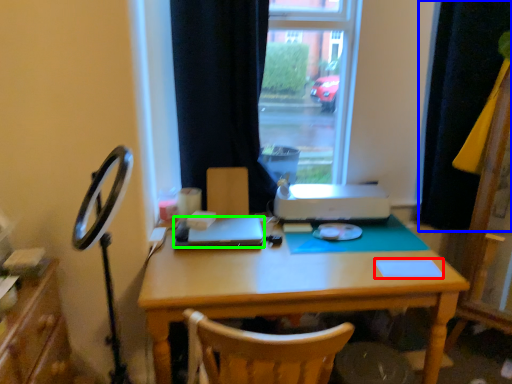
Question: Which object is the farthest from notepad (highlighted by a red box)? Choose among these: curtain (highlighted by a blue box) or laptop (highlighted by a green box).

Choices:
 (A) curtain
 (B) laptop

Answer: (A)